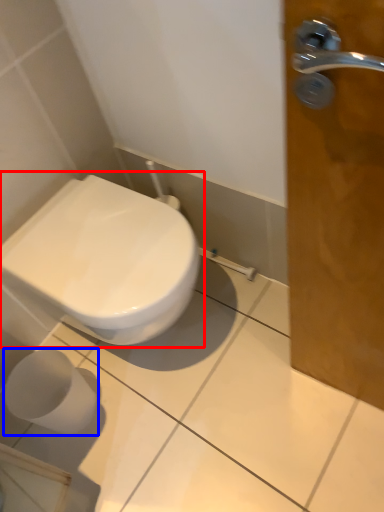
Question: Which object appears closest to the camera in this image, toilet (highlighted by a red box) or toilet paper (highlighted by a blue box)?

Choices:
 (A) toilet
 (B) toilet paper

Answer: (A)